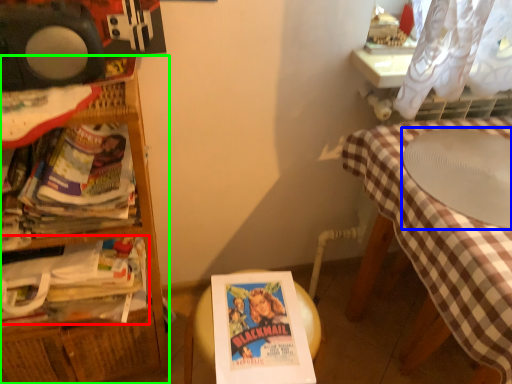
Question: Estimate the real-world distances between objects in this image. Which object is closer to book (highlighted by a red box), round table (highlighted by a blue box) or furniture (highlighted by a green box)?

Choices:
 (A) round table
 (B) furniture

Answer: (B)